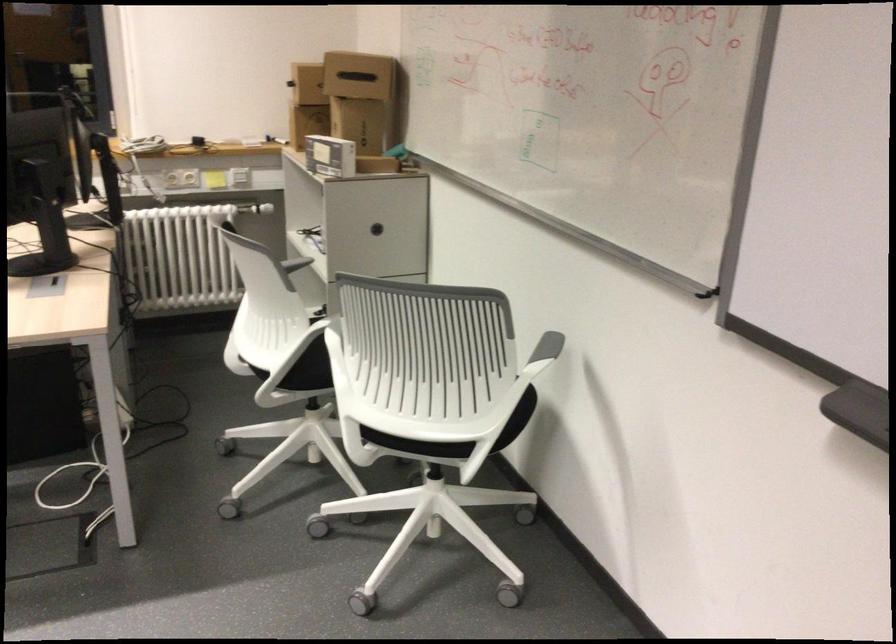
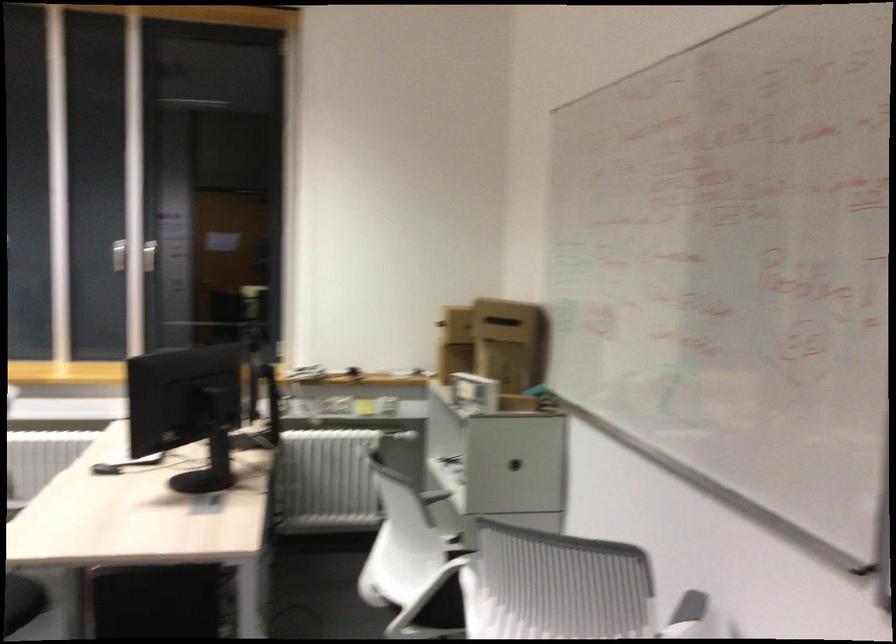
Question: Based on the continuous images, in which direction is the camera rotating? Reply with the corresponding letter.

Choices:
 (A) Left
 (B) Right
 (C) Up
 (D) Down

Answer: (C)